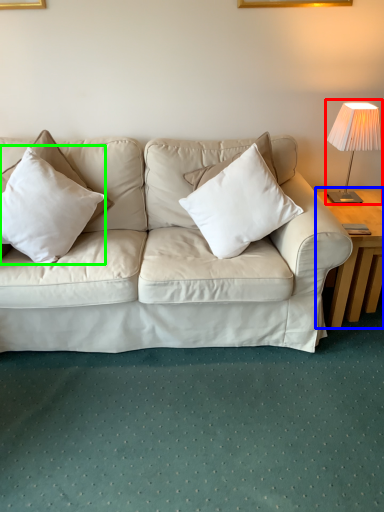
Question: Which object is the closest to the table lamp (highlighted by a red box)? Choose among these: table (highlighted by a blue box) or pillow (highlighted by a green box).

Choices:
 (A) table
 (B) pillow

Answer: (A)